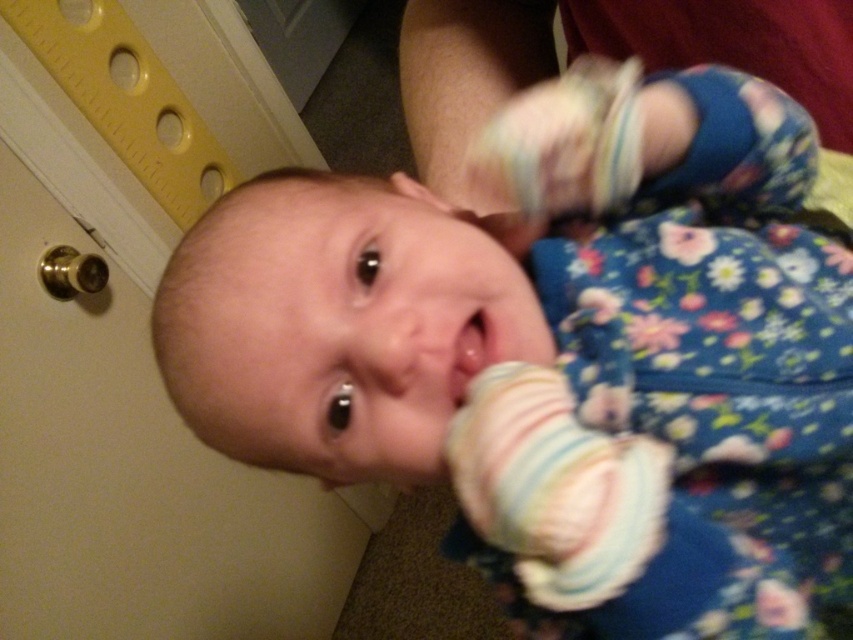
Question: Which of the following is the closest to the observer?

Choices:
 (A) floral fabric baby foot at center
 (B) smooth flesh mouth at center

Answer: (B)

Question: Can you confirm if floral fabric baby foot at center is bigger than smooth flesh mouth at center?

Choices:
 (A) no
 (B) yes

Answer: (B)

Question: Can you confirm if floral fabric baby foot at center is thinner than smooth flesh mouth at center?

Choices:
 (A) yes
 (B) no

Answer: (B)

Question: Which point appears closest to the camera in this image?

Choices:
 (A) (524, 61)
 (B) (454, 376)

Answer: (B)

Question: Can you confirm if floral fabric baby foot at center is positioned below smooth flesh mouth at center?

Choices:
 (A) no
 (B) yes

Answer: (A)